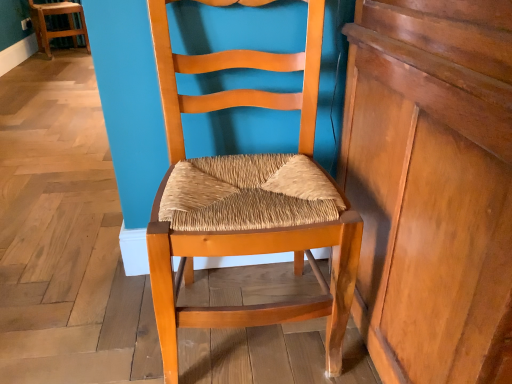
Question: Considering the positions of shiny brown wood dresser at right and wooden woven seat at center, marked as the first chair in a front-to-back arrangement, in the image, is shiny brown wood dresser at right bigger or smaller than wooden woven seat at center, marked as the first chair in a front-to-back arrangement,?

Choices:
 (A) small
 (B) big

Answer: (B)

Question: In terms of width, does shiny brown wood dresser at right look wider or thinner when compared to wooden woven seat at center, which is counted as the second chair, starting from the top?

Choices:
 (A) wide
 (B) thin

Answer: (A)

Question: Which object is positioned closest to the wooden woven seat at center, which appears as the 2th chair when viewed from the back?

Choices:
 (A) shiny brown wood dresser at right
 (B) wooden chair at upper left, which is the first chair from top to bottom

Answer: (A)

Question: Which of these objects is positioned closest to the wooden woven seat at center, marked as the first chair in a front-to-back arrangement?

Choices:
 (A) wooden chair at upper left, which ranks as the second chair in bottom-to-top order
 (B) shiny brown wood dresser at right

Answer: (B)